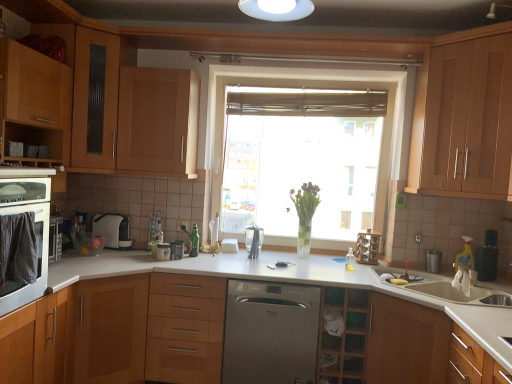
Image resolution: width=512 pixels, height=384 pixels. I want to click on wooden coffee machine at center, so click(x=367, y=248).

What do you see at coordinates (177, 249) in the screenshot? The width and height of the screenshot is (512, 384). I see `metallic silver toaster at center, acting as the 3th appliance starting from the right` at bounding box center [177, 249].

Describe the element at coordinates (464, 116) in the screenshot. The width and height of the screenshot is (512, 384). I see `wooden cabinet at upper right, the sixth cabinetry from the left` at that location.

Identify the location of matte white oven at left. (33, 221).

Where is `wooden coffee machine at center`? wooden coffee machine at center is located at coordinates (367, 248).

Considering the relative sizes of translucent glass window at center and matte wood cabinet at left, positioned as the 5th cabinetry in right-to-left order, in the image provided, is translucent glass window at center smaller than matte wood cabinet at left, positioned as the 5th cabinetry in right-to-left order,?

Actually, translucent glass window at center might be larger than matte wood cabinet at left, positioned as the 5th cabinetry in right-to-left order.

Does point (389, 159) come behind point (9, 345)?

Yes, it is behind point (9, 345).

Locate an element on the screen. This screenshot has width=512, height=384. cabinetry that is the 3rd object to the left of the translucent glass window at center, starting at the anchor is located at coordinates (36, 341).

Can you tell me how much wooden cabinet at left, which appears as the fourth cabinetry when viewed from the right, and wooden cabinet at center, marked as the second cabinetry in a right-to-left arrangement, differ in facing direction?

wooden cabinet at left, which appears as the fourth cabinetry when viewed from the right, and wooden cabinet at center, marked as the second cabinetry in a right-to-left arrangement, are facing 45.2 degrees away from each other.

Considering the positions of objects wooden cabinet at left, arranged as the third cabinetry when viewed from the left, and wooden cabinet at center, marked as the second cabinetry in a right-to-left arrangement, in the image provided, who is more to the left, wooden cabinet at left, arranged as the third cabinetry when viewed from the left, or wooden cabinet at center, marked as the second cabinetry in a right-to-left arrangement,?

From the viewer's perspective, wooden cabinet at left, arranged as the third cabinetry when viewed from the left, appears more on the left side.

The height and width of the screenshot is (384, 512). In order to click on cabinetry below the wooden cabinet at left, arranged as the third cabinetry when viewed from the left (from the image's perspective) in this screenshot , I will do pyautogui.click(x=343, y=336).

Could you tell me if wooden coffee machine at center is turned towards satin silver knife block at center, the 3th appliance when ordered from left to right?

No, wooden coffee machine at center is not oriented towards satin silver knife block at center, the 3th appliance when ordered from left to right.

Do you think wooden coffee machine at center is within satin silver knife block at center, the 3th appliance when ordered from left to right, or outside of it?

wooden coffee machine at center lies outside satin silver knife block at center, the 3th appliance when ordered from left to right.

Can you tell me how much wooden coffee machine at center and satin silver knife block at center, which appears as the second appliance when viewed from the right, differ in facing direction?

9.12 degrees.

In the image, there is a wooden cabinet at upper center, placed as the fourth cabinetry when sorted from left to right. At what (x,y) coordinates should I click in order to perform the action: click on window below it (from a real-world perspective). Please return your answer as a coordinate pair (x, y). Looking at the image, I should click on (305, 156).

Who is smaller, translucent glass window at center or wooden cabinet at upper center, placed as the fourth cabinetry when sorted from left to right?

With smaller size is wooden cabinet at upper center, placed as the fourth cabinetry when sorted from left to right.

Measure the distance from translucent glass window at center to wooden cabinet at upper center, the third cabinetry positioned from the right.

The distance of translucent glass window at center from wooden cabinet at upper center, the third cabinetry positioned from the right, is 1.07 meters.

Considering the relative sizes of satin silver coffee machine at lower left, placed as the fourth appliance when sorted from right to left, and wooden cabinet at left, which appears as the fourth cabinetry when viewed from the right, in the image provided, is satin silver coffee machine at lower left, placed as the fourth appliance when sorted from right to left, bigger than wooden cabinet at left, which appears as the fourth cabinetry when viewed from the right,?

No, satin silver coffee machine at lower left, placed as the fourth appliance when sorted from right to left, is not bigger than wooden cabinet at left, which appears as the fourth cabinetry when viewed from the right.

From the image's perspective, is satin silver coffee machine at lower left, placed as the fourth appliance when sorted from right to left, below wooden cabinet at left, arranged as the third cabinetry when viewed from the left?

No, from the image's perspective, satin silver coffee machine at lower left, placed as the fourth appliance when sorted from right to left, is not beneath wooden cabinet at left, arranged as the third cabinetry when viewed from the left.

Between satin silver coffee machine at lower left, which is the 1th appliance from left to right, and wooden cabinet at left, arranged as the third cabinetry when viewed from the left, which one has smaller width?

Thinner between the two is satin silver coffee machine at lower left, which is the 1th appliance from left to right.

Considering the positions of point (108, 230) and point (111, 356), is point (108, 230) closer or farther from the camera than point (111, 356)?

Point (108, 230).

Is point (98, 214) closer or farther from the camera than point (474, 265)?

Clearly, point (98, 214) is more distant from the camera than point (474, 265).

From the image's perspective, is satin silver coffee machine at lower left, which is the 1th appliance from left to right, located above yellow plastic spray bottle at right, the 4th appliance when ordered from left to right?

Yes, from the image's perspective, satin silver coffee machine at lower left, which is the 1th appliance from left to right, is above yellow plastic spray bottle at right, the 4th appliance when ordered from left to right.

Is satin silver coffee machine at lower left, placed as the fourth appliance when sorted from right to left, shorter than yellow plastic spray bottle at right, positioned as the 1th appliance in right-to-left order?

In fact, satin silver coffee machine at lower left, placed as the fourth appliance when sorted from right to left, may be taller than yellow plastic spray bottle at right, positioned as the 1th appliance in right-to-left order.

Choose the correct answer: Is satin silver coffee machine at lower left, placed as the fourth appliance when sorted from right to left, inside yellow plastic spray bottle at right, the 4th appliance when ordered from left to right, or outside it?

satin silver coffee machine at lower left, placed as the fourth appliance when sorted from right to left, cannot be found inside yellow plastic spray bottle at right, the 4th appliance when ordered from left to right.

Is satin metallic dishwasher at center at the back of translucent glass window at center?

No, translucent glass window at center is not facing away from satin metallic dishwasher at center.

Is translucent glass window at center positioned behind satin metallic dishwasher at center?

Yes, it is behind satin metallic dishwasher at center.

Who is shorter, translucent glass window at center or satin metallic dishwasher at center?

satin metallic dishwasher at center is shorter.

Considering the sizes of translucent glass window at center and satin metallic dishwasher at center in the image, is translucent glass window at center bigger or smaller than satin metallic dishwasher at center?

Considering their sizes, translucent glass window at center takes up more space than satin metallic dishwasher at center.

Locate an element on the screen. This screenshot has height=384, width=512. window that appears on the right of matte wood cabinet at left, placed as the second cabinetry when sorted from left to right is located at coordinates tap(305, 156).

Locate an element on the screen. cabinetry below the wooden cabinet at left, which appears as the fourth cabinetry when viewed from the right (from the image's perspective) is located at coordinates (343, 336).

Looking at this image, based on their spatial positions, is wooden cabinet at left, arranged as the third cabinetry when viewed from the left, or wooden cabinet at upper center, the third cabinetry positioned from the right, further from matte white oven at left?

wooden cabinet at upper center, the third cabinetry positioned from the right, is further to matte white oven at left.

Based on their spatial positions, is wooden cabinet at left, acting as the first cabinetry starting from the left, or satin silver coffee machine at lower left, which is the 1th appliance from left to right, closer to yellow plastic spray bottle at right, positioned as the 1th appliance in right-to-left order?

satin silver coffee machine at lower left, which is the 1th appliance from left to right, is closer to yellow plastic spray bottle at right, positioned as the 1th appliance in right-to-left order.

Which object lies nearer to the anchor point wooden cabinet at left, arranged as the third cabinetry when viewed from the left, wooden cabinet at center, which is counted as the fifth cabinetry, starting from the left, or translucent glass window at center?

Among the two, wooden cabinet at center, which is counted as the fifth cabinetry, starting from the left, is located nearer to wooden cabinet at left, arranged as the third cabinetry when viewed from the left.

Which object lies nearer to the anchor point wooden cabinet at left, which appears as the sixth cabinetry when viewed from the right, yellow plastic spray bottle at right, the 4th appliance when ordered from left to right, or metallic silver toaster at center, the 2th appliance in the left-to-right sequence?

metallic silver toaster at center, the 2th appliance in the left-to-right sequence, is positioned closer to the anchor wooden cabinet at left, which appears as the sixth cabinetry when viewed from the right.

Which object lies nearer to the anchor point satin silver knife block at center, which appears as the second appliance when viewed from the right, satin metallic dishwasher at center or translucent glass window at center?

Based on the image, satin metallic dishwasher at center appears to be nearer to satin silver knife block at center, which appears as the second appliance when viewed from the right.

Considering their positions, is satin silver coffee machine at lower left, placed as the fourth appliance when sorted from right to left, positioned further to green plastic faucet at center than satin metallic dishwasher at center?

Among the two, satin metallic dishwasher at center is located further to green plastic faucet at center.

Looking at this image, which object lies further to the anchor point satin silver knife block at center, the 3th appliance when ordered from left to right, wooden cabinet at upper center, placed as the fourth cabinetry when sorted from left to right, or yellow plastic spray bottle at right, positioned as the 1th appliance in right-to-left order?

yellow plastic spray bottle at right, positioned as the 1th appliance in right-to-left order, is further to satin silver knife block at center, the 3th appliance when ordered from left to right.

Which object lies further to the anchor point wooden cabinet at left, arranged as the third cabinetry when viewed from the left, satin metallic dishwasher at center or green plastic faucet at center?

→ Based on the image, green plastic faucet at center appears to be further to wooden cabinet at left, arranged as the third cabinetry when viewed from the left.

Where is `faucet between wooden cabinet at left, acting as the first cabinetry starting from the left, and wooden cabinet at left, which appears as the fourth cabinetry when viewed from the right, in the vertical direction`? Image resolution: width=512 pixels, height=384 pixels. faucet between wooden cabinet at left, acting as the first cabinetry starting from the left, and wooden cabinet at left, which appears as the fourth cabinetry when viewed from the right, in the vertical direction is located at coordinates (192, 240).

This screenshot has width=512, height=384. Identify the location of dish washer located between wooden drawer at center and clear glass vase at center in the left-right direction. (270, 333).

Where is `drawer situated between matte white oven at left and clear glass vase at center from left to right`? drawer situated between matte white oven at left and clear glass vase at center from left to right is located at coordinates (185, 328).

Locate an element on the screen. The image size is (512, 384). drawer located between wooden cabinet at left, arranged as the third cabinetry when viewed from the left, and satin metallic dishwasher at center in the left-right direction is located at coordinates (185, 328).